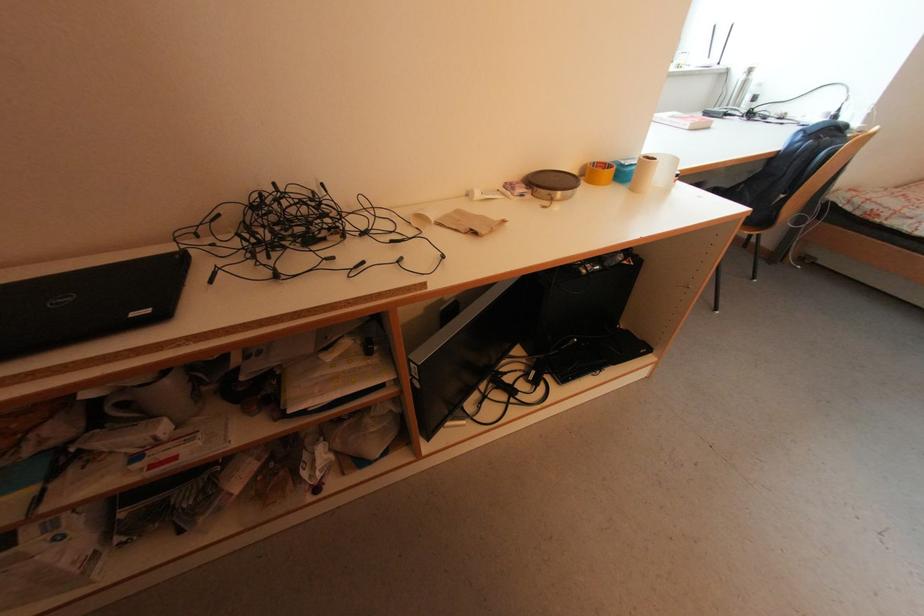
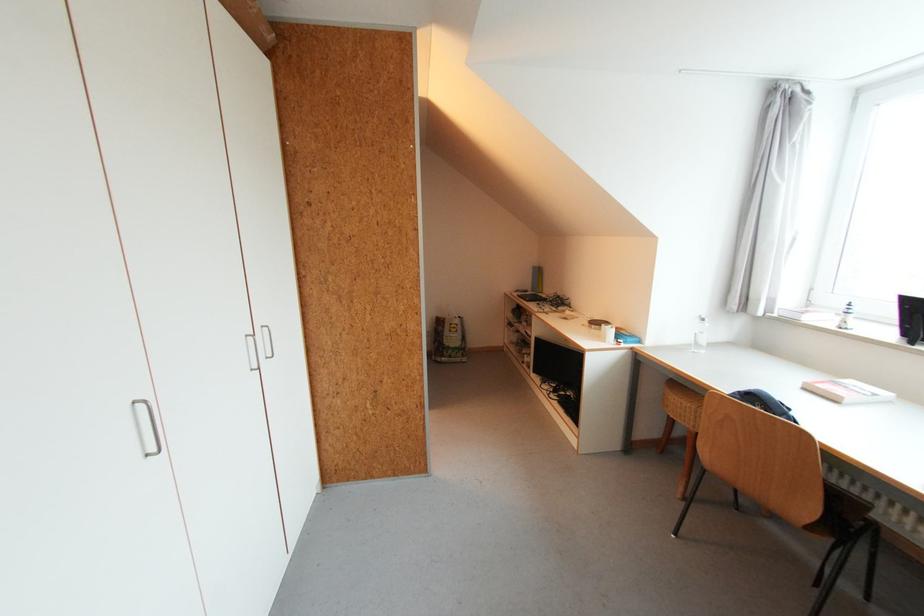
The point at (714,129) is marked in the first image. Where is the corresponding point in the second image?

(841, 403)